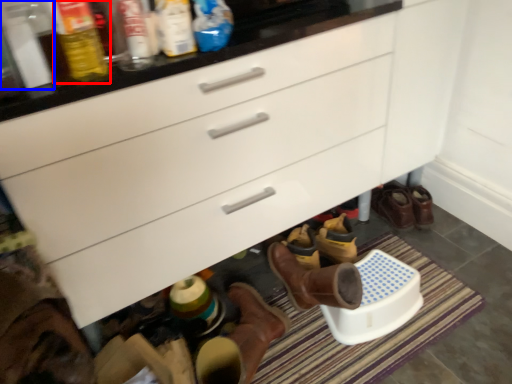
Question: Which object appears farthest to the camera in this image, bottle (highlighted by a red box) or bottle (highlighted by a blue box)?

Choices:
 (A) bottle
 (B) bottle

Answer: (B)